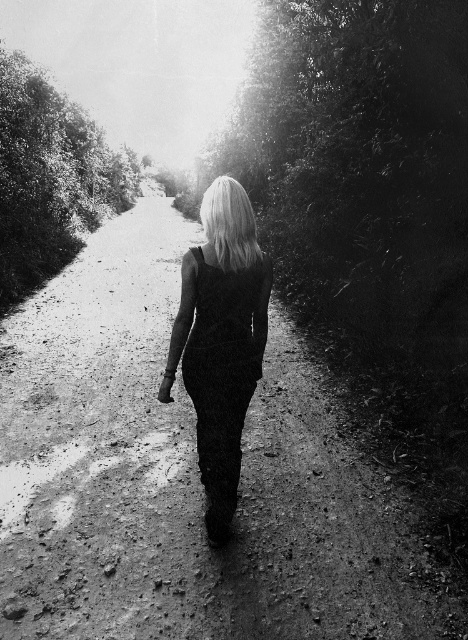
Does point (227, 438) come farther from viewer compared to point (233, 211)?

That is True.

Does black textured pants at center have a lesser width compared to blonde hair at center?

Indeed, black textured pants at center has a lesser width compared to blonde hair at center.

Is point (216, 225) farther from viewer compared to point (241, 252)?

Yes, point (216, 225) is behind point (241, 252).

What are the coordinates of `black textured pants at center` in the screenshot? It's located at (220, 340).